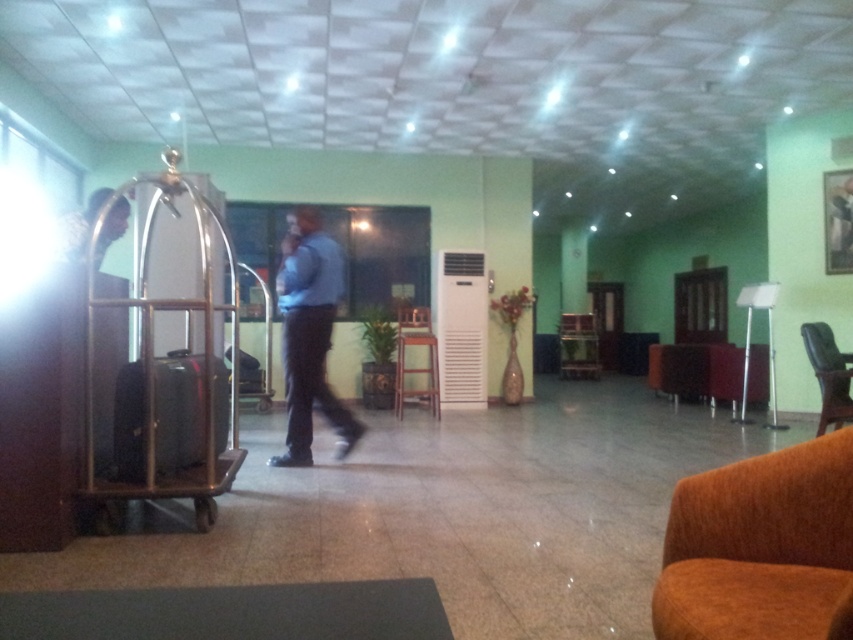
You are standing in the hotel lobby and see the blue shirt at center and the shiny black suitcase at left. Which object is higher in position?

The blue shirt at center is above shiny black suitcase at left, so the blue shirt at center is higher in position.

You are a hotel staff member trying to determine if the blue shirt at center and the shiny black suitcase at left can fit side by side on a 1.5 meter wide shelf. Can both items be placed next to each other without overlapping?

The blue shirt at center is wider than the shiny black suitcase at left. However, since the total combined width of both items is not provided, it is impossible to determine if they can fit on the 1.5 meter wide shelf without additional information.

You are a guest in the hotel lobby and want to sit down in the brown fabric armchair at center. However, there is a light brown leather jacket at left nearby. Where exactly is the jacket in relation to the chair?

The light brown leather jacket at left is positioned above the brown fabric armchair at center.